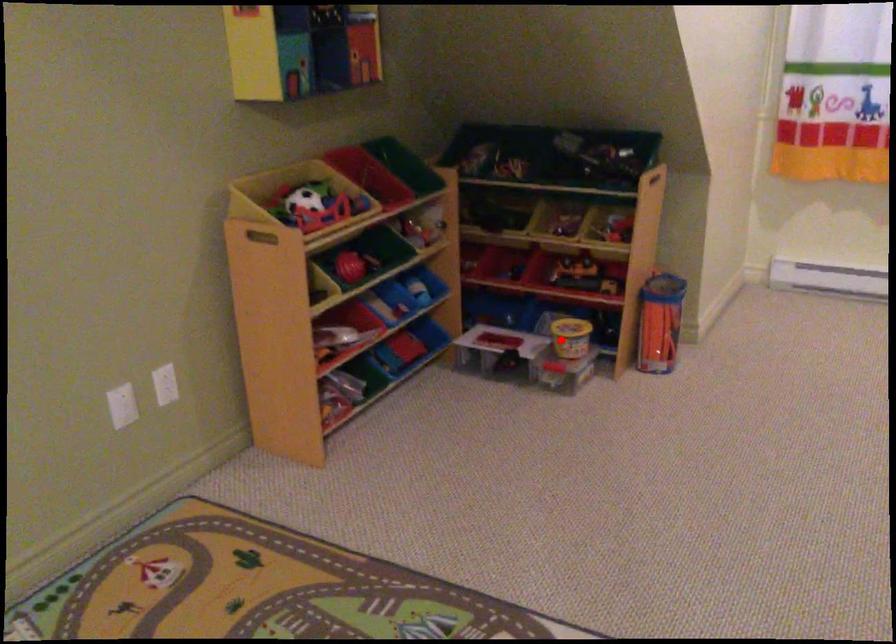
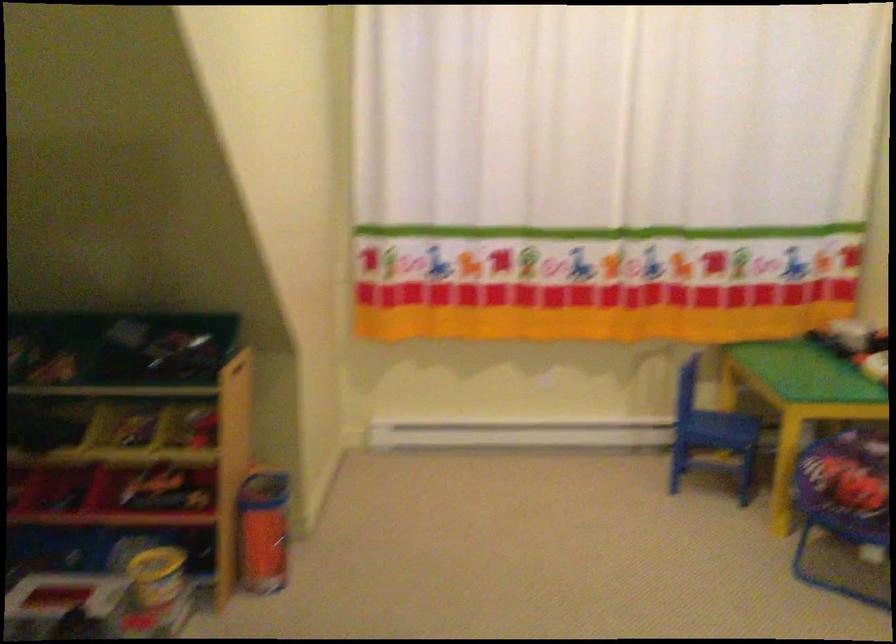
In the second image, find the point that corresponds to the highlighted location in the first image.

(156, 576)